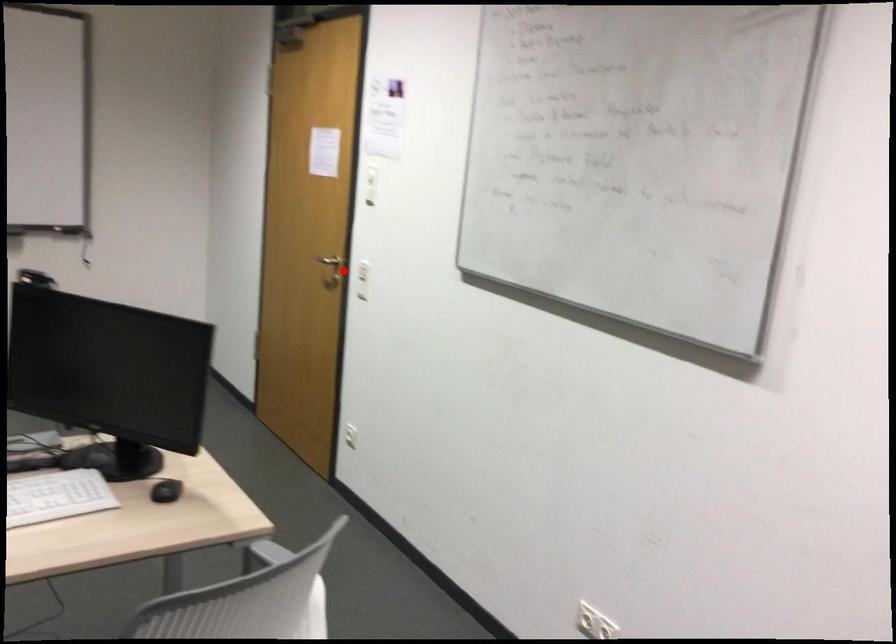
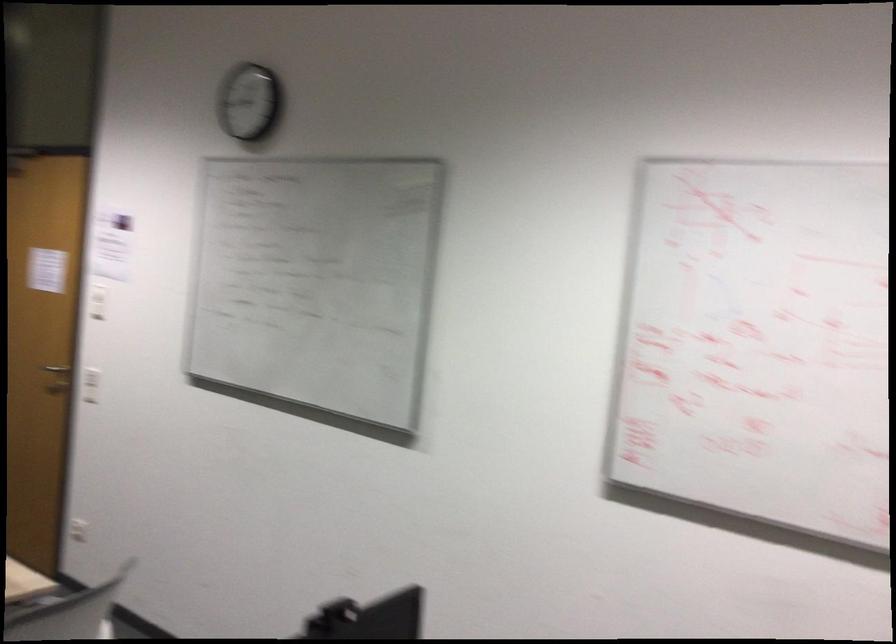
Question: I am providing you with two images of the same scene from different viewpoints. A red point is marked on the first image. Is the red point's position out of view in image 2?

Choices:
 (A) Yes
 (B) No

Answer: (B)